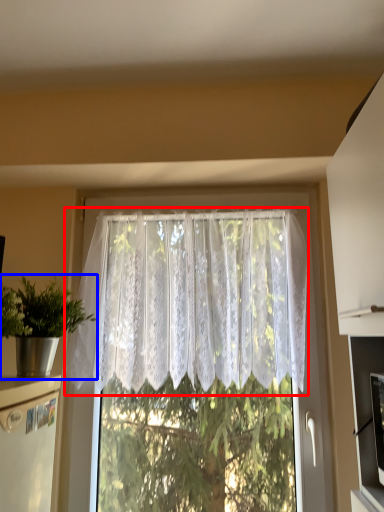
Question: Among these objects, which one is nearest to the camera, curtain (highlighted by a red box) or houseplant (highlighted by a blue box)?

Choices:
 (A) curtain
 (B) houseplant

Answer: (B)